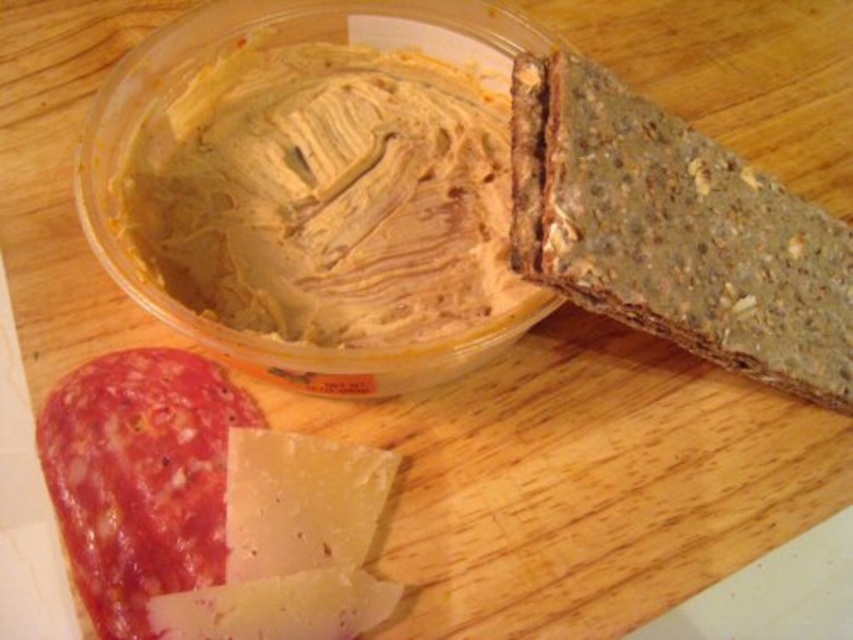
You are a food stylist arranging items on a table. You have two points marked on the table surface at coordinates point (805, 246) and point (276, 636). Which point is closer to you when you are standing at the edge of the table facing the setup?

Point (805, 246) is closer to you because it is further to the viewer than point (276, 636).

You are arranging snacks on a wooden table and have the dark brown textured bread at upper right and the white crumbly cheese at lower left. Which snack is positioned higher on the table?

The dark brown textured bread at upper right is positioned higher on the table than the white crumbly cheese at lower left.

You are a food stylist arranging items on a wooden table. You need to place a decorative plate at the center of the table. However, there is a dark brown textured bread at upper right. Where should you place the plate to avoid overlapping with the bread?

Place the plate away from the dark brown textured bread at upper right, which is located at point (x=675, y=232). The center of the table is likely clear of this item.